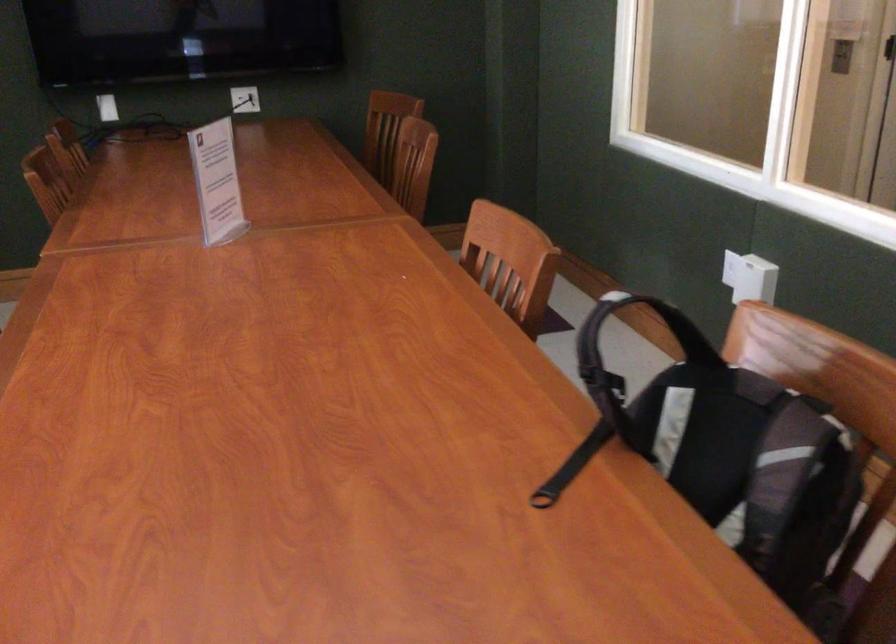
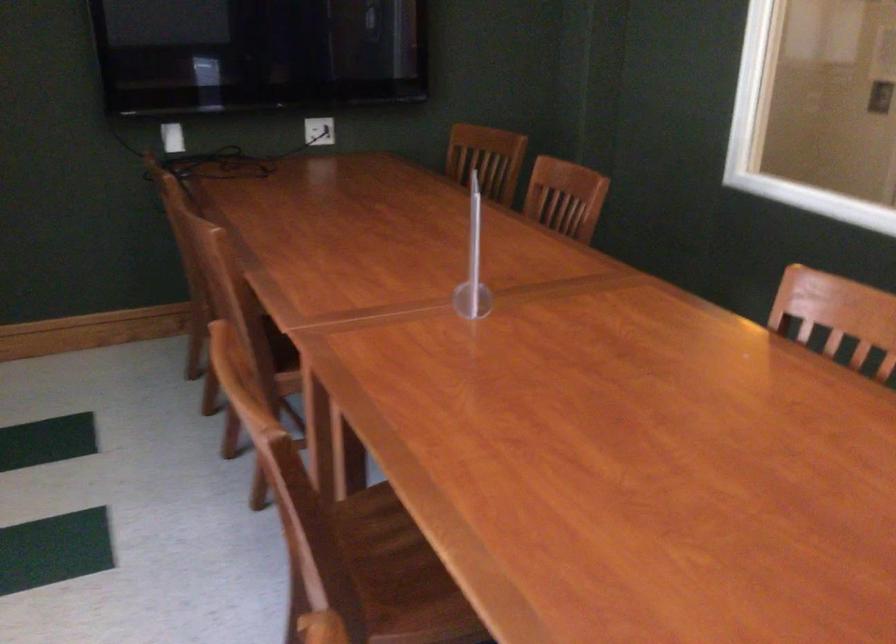
Where in the second image is the point corresponding to (510,242) from the first image?

(841, 313)